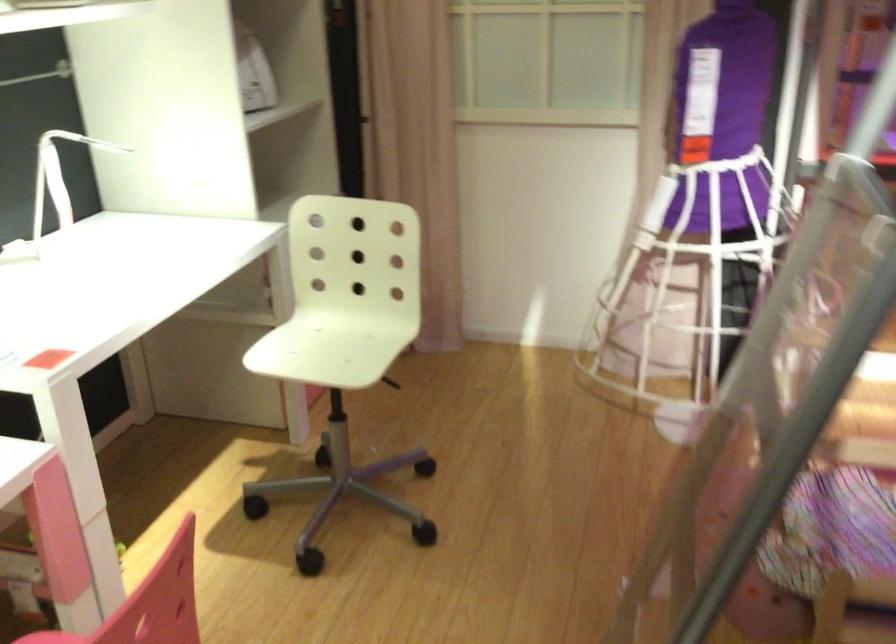
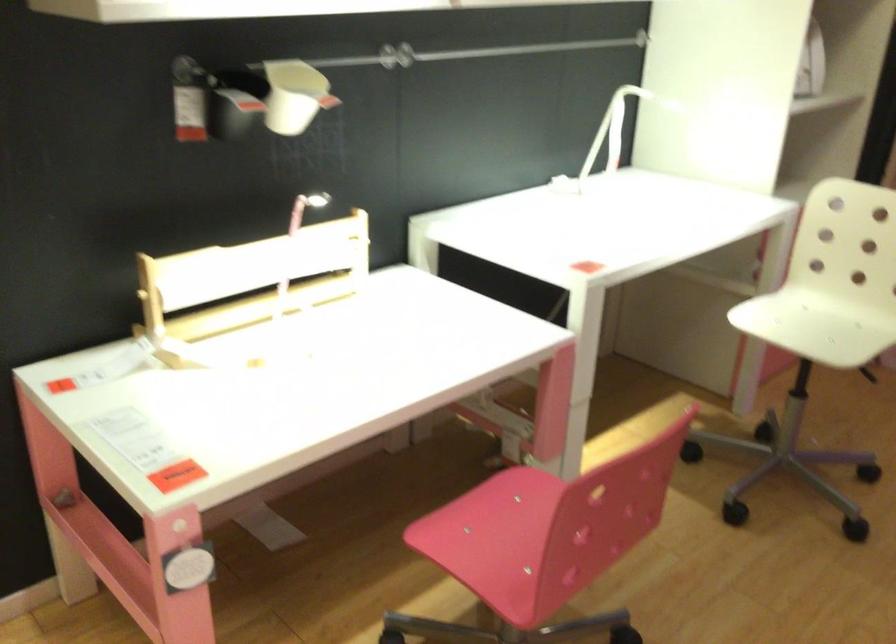
Question: How did the camera likely rotate?

Choices:
 (A) Left
 (B) Right
 (C) Up
 (D) Down

Answer: (A)